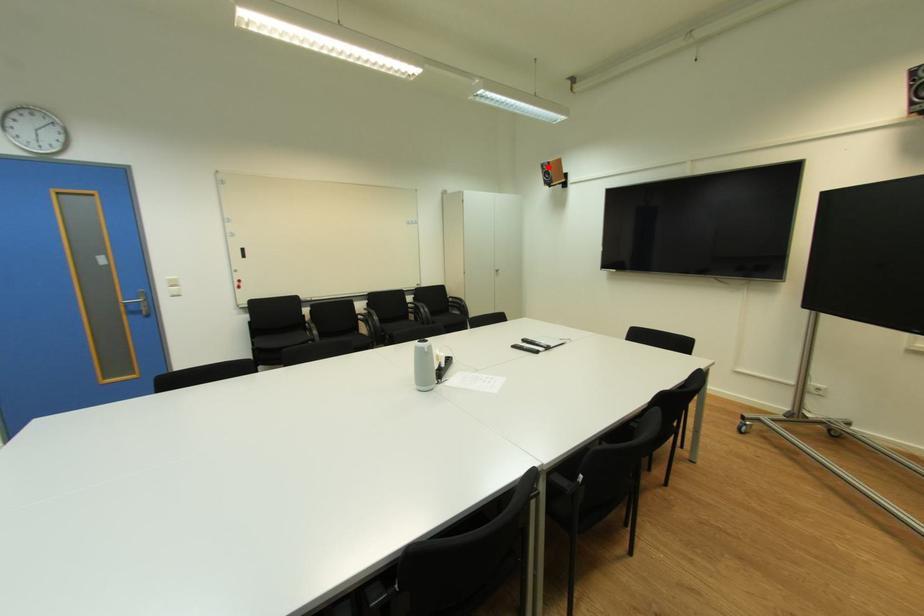
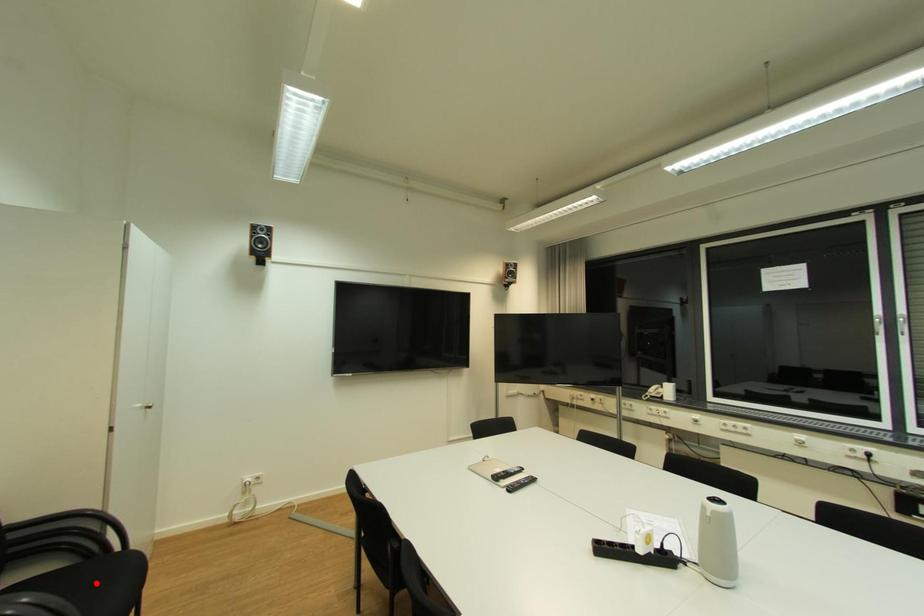
I am providing you with two images of the same scene from different viewpoints. A red point is marked on the first image and another point is marked on the second image. Is the red point in image1 aligned with the point shown in image2?

No